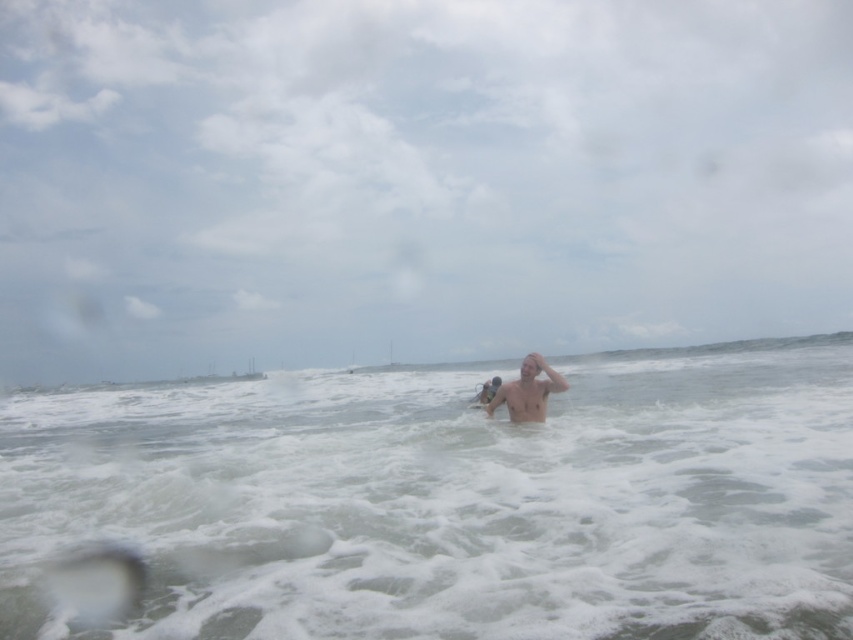
Question: Which of the following is the closest to the observer?

Choices:
 (A) (500, 392)
 (B) (120, 429)

Answer: (A)

Question: Does white foamy water at center appear under shiny skin head at center?

Choices:
 (A) yes
 (B) no

Answer: (A)

Question: Does white foamy water at center come in front of shiny skin head at center?

Choices:
 (A) yes
 (B) no

Answer: (A)

Question: Does white foamy water at center appear on the left side of shiny skin head at center?

Choices:
 (A) yes
 (B) no

Answer: (A)